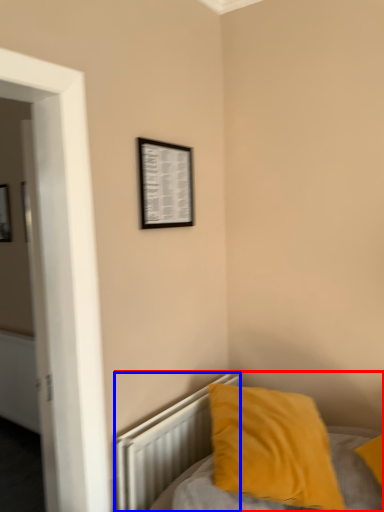
Question: Which object is closer to the camera taking this photo, bed (highlighted by a red box) or radiator (highlighted by a blue box)?

Choices:
 (A) bed
 (B) radiator

Answer: (A)